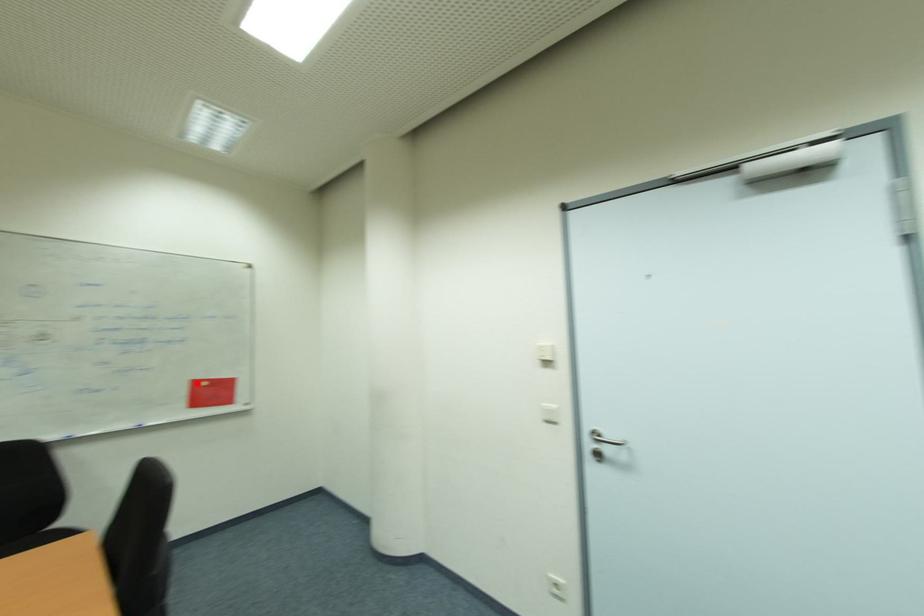
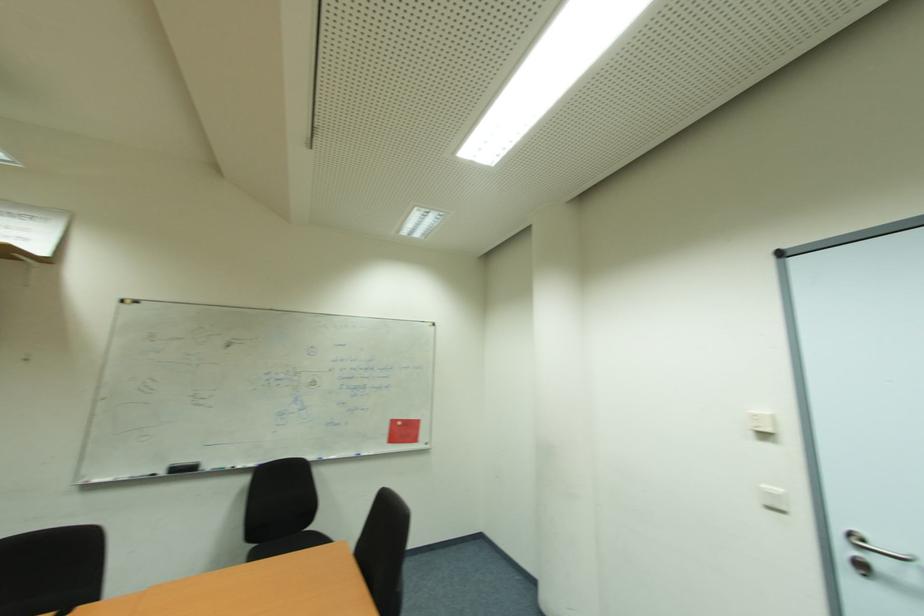
Locate, in the second image, the point that corresponds to the highlighted location in the first image.

(397, 423)